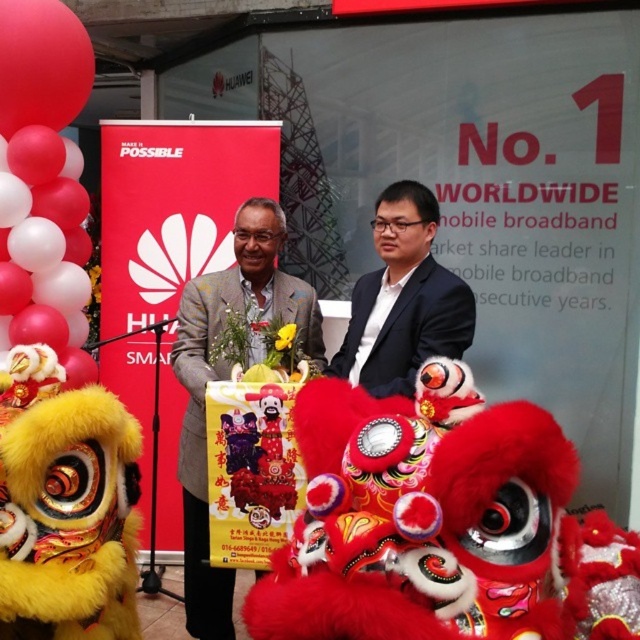
Is red matte balloons at upper left positioned at the back of gray textured suit at center?

Yes, it is behind gray textured suit at center.

Is red matte balloons at upper left taller than gray textured suit at center?

Yes.

Who is more forward, (72,298) or (294,282)?

Positioned in front is point (294,282).

Locate an element on the screen. The height and width of the screenshot is (640, 640). red matte balloons at upper left is located at coordinates (44, 182).

Does red matte balloons at upper left have a greater height compared to black glossy suit at center?

Yes, red matte balloons at upper left is taller than black glossy suit at center.

Locate an element on the screen. red matte balloons at upper left is located at coordinates (44, 182).

Is gray textured suit at center to the right of black glossy suit at center from the viewer's perspective?

In fact, gray textured suit at center is to the left of black glossy suit at center.

Which is behind, point (228, 278) or point (422, 241)?

The point (228, 278) is behind.

At what (x,y) coordinates should I click in order to perform the action: click on gray textured suit at center. Please return your answer as a coordinate pair (x, y). This screenshot has width=640, height=640. Looking at the image, I should click on (228, 378).